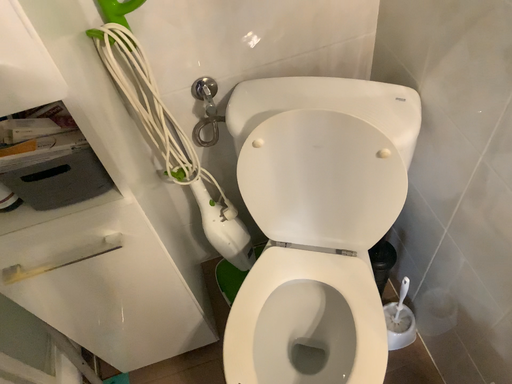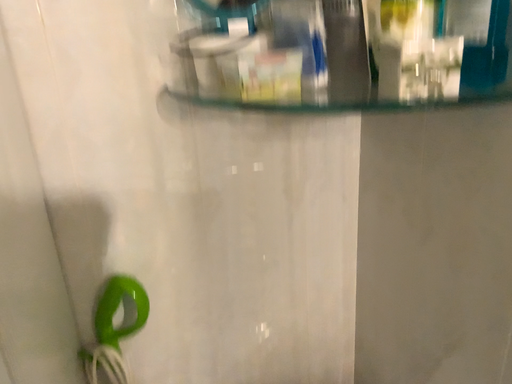
Question: Which way did the camera rotate in the video?

Choices:
 (A) rotated downward
 (B) rotated upward

Answer: (B)